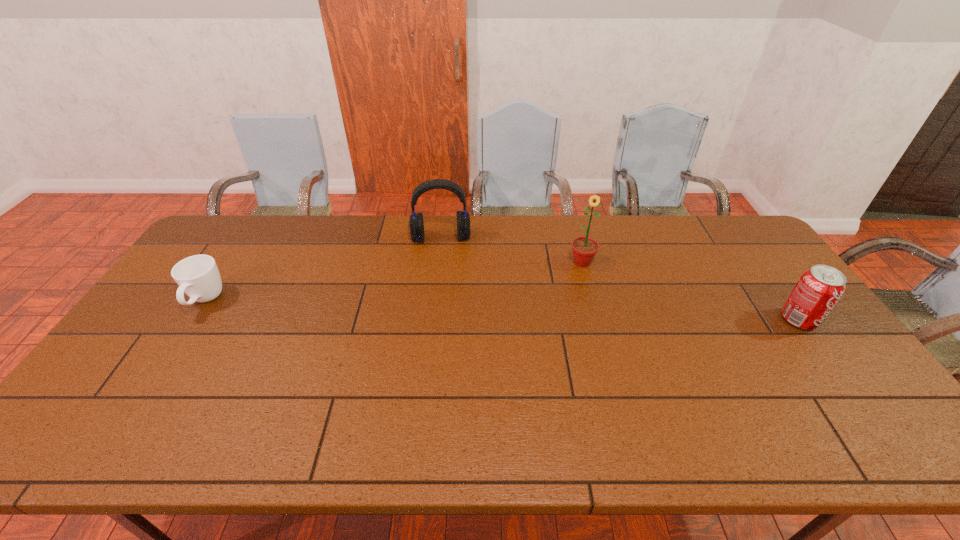
Where is `free space on the desktop that is between the leftmost object and the soda and is positioned on the headband of the second object from left to right`? The height and width of the screenshot is (540, 960). free space on the desktop that is between the leftmost object and the soda and is positioned on the headband of the second object from left to right is located at coordinates (443, 308).

At what (x,y) coordinates should I click in order to perform the action: click on free spot on the desktop that is between the leftmost object and the third tallest object and is positioned on the face of the third object from left to right. Please return your answer as a coordinate pair (x, y). Looking at the image, I should click on (579, 313).